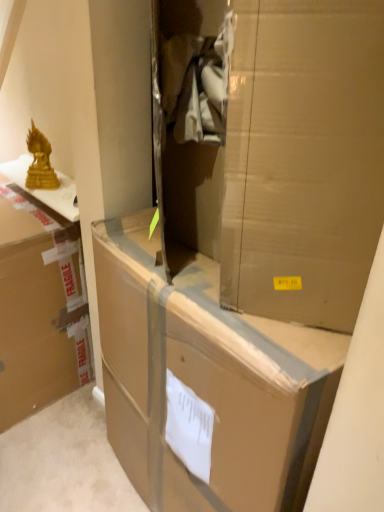
Where is `cardboard box at center, which is counted as the second box, starting from the left`? The image size is (384, 512). cardboard box at center, which is counted as the second box, starting from the left is located at coordinates (207, 379).

In order to click on brown cardboard box at center in this screenshot , I will do `click(281, 150)`.

Measure the distance between gold metallic statue at upper left and camera.

They are 1.39 meters apart.

What do you see at coordinates (38, 310) in the screenshot? I see `brown cardboard box at left, positioned as the first box in left-to-right order` at bounding box center [38, 310].

Locate an element on the screen. This screenshot has height=512, width=384. cardboard box at center, which is counted as the second box, starting from the left is located at coordinates (207, 379).

Considering the sizes of objects brown cardboard box at center and cardboard box at center, the first box from the right, in the image provided, who is taller, brown cardboard box at center or cardboard box at center, the first box from the right,?

cardboard box at center, the first box from the right.

Would you consider brown cardboard box at center to be distant from cardboard box at center, the first box from the right?

No, brown cardboard box at center is not far away from cardboard box at center, the first box from the right.

Between point (178, 32) and point (125, 271), which one is positioned in front?

The point (178, 32) is more forward.

Is brown cardboard box at center in front of or behind cardboard box at center, the first box from the right, in the image?

brown cardboard box at center is positioned closer to the viewer than cardboard box at center, the first box from the right.

Which point is more distant from viewer, (166, 508) or (207, 20)?

The point (166, 508) is farther from the camera.

Is brown cardboard box at center located within cardboard box at center, which is counted as the second box, starting from the left?

No, cardboard box at center, which is counted as the second box, starting from the left, does not contain brown cardboard box at center.

Who is more distant, cardboard box at center, the first box from the right, or brown cardboard box at center?

cardboard box at center, the first box from the right, is more distant.

I want to click on cardboard box on the right side of cardboard box at center, the first box from the right, so click(281, 150).

From a real-world perspective, is gold metallic statue at upper left under brown cardboard box at left, the second box when ordered from right to left?

Incorrect, from a real-world perspective, gold metallic statue at upper left is higher than brown cardboard box at left, the second box when ordered from right to left.

Is gold metallic statue at upper left to the left or to the right of brown cardboard box at left, the second box when ordered from right to left, in the image?

In the image, gold metallic statue at upper left appears on the right side of brown cardboard box at left, the second box when ordered from right to left.

Could you measure the distance between gold metallic statue at upper left and brown cardboard box at left, the second box when ordered from right to left?

gold metallic statue at upper left and brown cardboard box at left, the second box when ordered from right to left, are 15.30 inches apart from each other.

Which point is more distant from viewer, (32, 132) or (50, 323)?

The point (50, 323) is more distant.

From a real-world perspective, is brown cardboard box at left, positioned as the first box in left-to-right order, under brown cardboard box at center?

Yes, from a real-world perspective, brown cardboard box at left, positioned as the first box in left-to-right order, is under brown cardboard box at center.

Is point (28, 304) more distant than point (175, 2)?

Yes, point (28, 304) is behind point (175, 2).

What are the coordinates of `cardboard box above the brown cardboard box at left, positioned as the first box in left-to-right order (from a real-world perspective)` in the screenshot? It's located at (281, 150).

Is brown cardboard box at left, positioned as the first box in left-to-right order, not near gold metallic statue at upper left?

brown cardboard box at left, positioned as the first box in left-to-right order, is near gold metallic statue at upper left, not far away.

From the picture: Which is less distant, [30,341] or [38,143]?

The point [38,143] is closer.

Which object is further away from the camera taking this photo, brown cardboard box at left, positioned as the first box in left-to-right order, or gold metallic statue at upper left?

Positioned behind is gold metallic statue at upper left.

How different are the orientations of brown cardboard box at left, the second box when ordered from right to left, and gold metallic statue at upper left in degrees?

The angular difference between brown cardboard box at left, the second box when ordered from right to left, and gold metallic statue at upper left is 1.2 degrees.

Based on the photo, could you measure the distance between cardboard box at center, the first box from the right, and brown cardboard box at left, positioned as the first box in left-to-right order?

The distance of cardboard box at center, the first box from the right, from brown cardboard box at left, positioned as the first box in left-to-right order, is 21.74 inches.

From the image's perspective, is cardboard box at center, which is counted as the second box, starting from the left, positioned above or below brown cardboard box at left, the second box when ordered from right to left?

From the image's perspective, cardboard box at center, which is counted as the second box, starting from the left, appears below brown cardboard box at left, the second box when ordered from right to left.

Is cardboard box at center, which is counted as the second box, starting from the left, far away from brown cardboard box at left, the second box when ordered from right to left?

No.

Which of these two, cardboard box at center, which is counted as the second box, starting from the left, or brown cardboard box at left, the second box when ordered from right to left, is bigger?

cardboard box at center, which is counted as the second box, starting from the left, is bigger.

From the image's perspective, is gold metallic statue at upper left below brown cardboard box at center?

No, from the image's perspective, gold metallic statue at upper left is not below brown cardboard box at center.

Considering the points (37, 156) and (179, 120), which point is behind, point (37, 156) or point (179, 120)?

Positioned behind is point (37, 156).

Would you say gold metallic statue at upper left contains brown cardboard box at center?

No, brown cardboard box at center is not a part of gold metallic statue at upper left.

From a real-world perspective, is gold metallic statue at upper left physically located above or below brown cardboard box at center?

From a real-world perspective, gold metallic statue at upper left is physically below brown cardboard box at center.

Identify the location of cardboard box lying on the right of cardboard box at center, which is counted as the second box, starting from the left. The height and width of the screenshot is (512, 384). (281, 150).

The width and height of the screenshot is (384, 512). I want to click on box that is the 1st one when counting backward from the brown cardboard box at center, so click(207, 379).

From the image, which object appears to be nearer to gold metallic statue at upper left, brown cardboard box at left, the second box when ordered from right to left, or cardboard box at center, the first box from the right?

Among the two, brown cardboard box at left, the second box when ordered from right to left, is located nearer to gold metallic statue at upper left.

Estimate the real-world distances between objects in this image. Which object is closer to brown cardboard box at left, positioned as the first box in left-to-right order, cardboard box at center, which is counted as the second box, starting from the left, or brown cardboard box at center?

Based on the image, cardboard box at center, which is counted as the second box, starting from the left, appears to be nearer to brown cardboard box at left, positioned as the first box in left-to-right order.

Looking at the image, which one is located closer to cardboard box at center, the first box from the right, gold metallic statue at upper left or brown cardboard box at left, the second box when ordered from right to left?

brown cardboard box at left, the second box when ordered from right to left.

Based on the photo, considering their positions, is cardboard box at center, the first box from the right, positioned closer to brown cardboard box at left, the second box when ordered from right to left, than gold metallic statue at upper left?

The object closer to brown cardboard box at left, the second box when ordered from right to left, is gold metallic statue at upper left.

Estimate the real-world distances between objects in this image. Which object is closer to cardboard box at center, the first box from the right, brown cardboard box at left, the second box when ordered from right to left, or brown cardboard box at center?

brown cardboard box at center lies closer to cardboard box at center, the first box from the right, than the other object.

Estimate the real-world distances between objects in this image. Which object is further from cardboard box at center, the first box from the right, brown cardboard box at center or gold metallic statue at upper left?

gold metallic statue at upper left is positioned further to the anchor cardboard box at center, the first box from the right.

Based on the photo, which object lies nearer to the anchor point brown cardboard box at left, the second box when ordered from right to left, brown cardboard box at center or cardboard box at center, the first box from the right?

cardboard box at center, the first box from the right, lies closer to brown cardboard box at left, the second box when ordered from right to left, than the other object.

Looking at the image, which one is located closer to brown cardboard box at center, brown cardboard box at left, positioned as the first box in left-to-right order, or gold metallic statue at upper left?

brown cardboard box at left, positioned as the first box in left-to-right order, is positioned closer to the anchor brown cardboard box at center.

The width and height of the screenshot is (384, 512). Find the location of `box between brown cardboard box at left, the second box when ordered from right to left, and brown cardboard box at center from left to right`. box between brown cardboard box at left, the second box when ordered from right to left, and brown cardboard box at center from left to right is located at coordinates (207, 379).

This screenshot has height=512, width=384. Find the location of `wrap located between brown cardboard box at left, positioned as the first box in left-to-right order, and cardboard box at center, which is counted as the second box, starting from the left, in the left-right direction`. wrap located between brown cardboard box at left, positioned as the first box in left-to-right order, and cardboard box at center, which is counted as the second box, starting from the left, in the left-right direction is located at coordinates (40, 162).